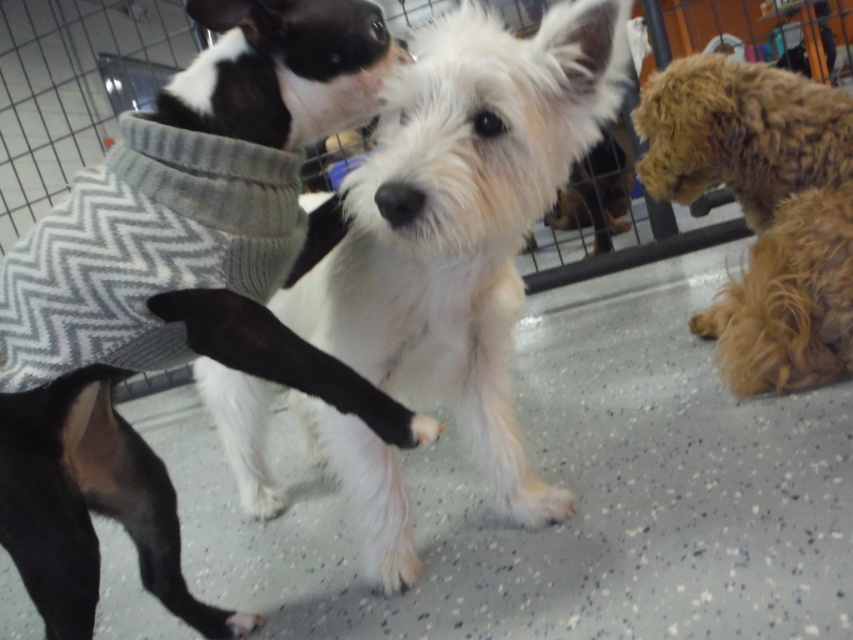
Who is positioned more to the left, black and white sweater at upper left or fuzzy brown dog at right?

black and white sweater at upper left

Is black and white sweater at upper left bigger than fuzzy brown dog at right?

Yes.

Between point (15, 493) and point (793, 349), which one is positioned behind?

Point (793, 349)

The height and width of the screenshot is (640, 853). In order to click on black and white sweater at upper left in this screenshot , I will do `click(177, 291)`.

Does point (231, 410) come in front of point (787, 256)?

No, it is behind (787, 256).

The width and height of the screenshot is (853, 640). In order to click on white fluffy dog at center in this screenshot , I will do `click(463, 220)`.

In order to click on white fluffy dog at center in this screenshot , I will do `click(463, 220)`.

Which is in front, point (213, 4) or point (619, 35)?

Point (619, 35) is more forward.

Who is lower down, black and white sweater at upper left or white fluffy dog at center?

white fluffy dog at center is lower down.

Locate an element on the screen. This screenshot has height=640, width=853. black and white sweater at upper left is located at coordinates (177, 291).